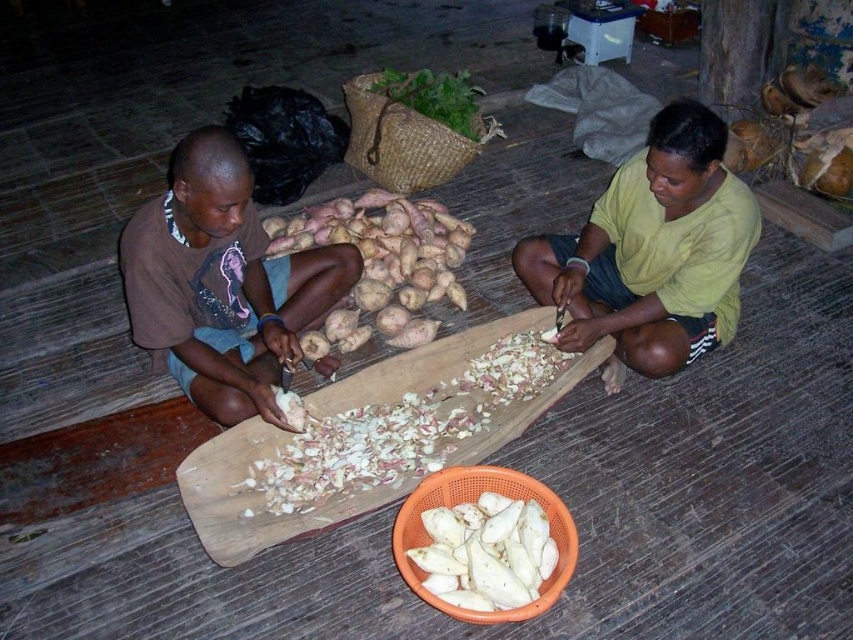
Who is lower down, brown cotton shirt at left or white matte potato at center?

white matte potato at center is below.

Is brown cotton shirt at left to the right of white matte potato at center from the viewer's perspective?

In fact, brown cotton shirt at left is to the left of white matte potato at center.

Is point (142, 260) less distant than point (279, 460)?

Yes.

This screenshot has height=640, width=853. In order to click on brown cotton shirt at left in this screenshot , I will do `click(222, 284)`.

Is white matte potato at center taller than green leafy vegetable at upper center?

Yes.

Does white matte potato at center appear over green leafy vegetable at upper center?

Incorrect, white matte potato at center is not positioned above green leafy vegetable at upper center.

Is point (317, 483) behind point (462, 76)?

No, it is not.

The height and width of the screenshot is (640, 853). In order to click on white matte potato at center in this screenshot , I will do `click(399, 429)`.

Between yellow matte shirt at center and brown matte potatoes at center, which one is positioned higher?

brown matte potatoes at center is higher up.

Looking at this image, can you confirm if yellow matte shirt at center is shorter than brown matte potatoes at center?

Incorrect, yellow matte shirt at center's height does not fall short of brown matte potatoes at center's.

Where is `yellow matte shirt at center`? This screenshot has height=640, width=853. yellow matte shirt at center is located at coordinates (653, 250).

The width and height of the screenshot is (853, 640). I want to click on yellow matte shirt at center, so click(653, 250).